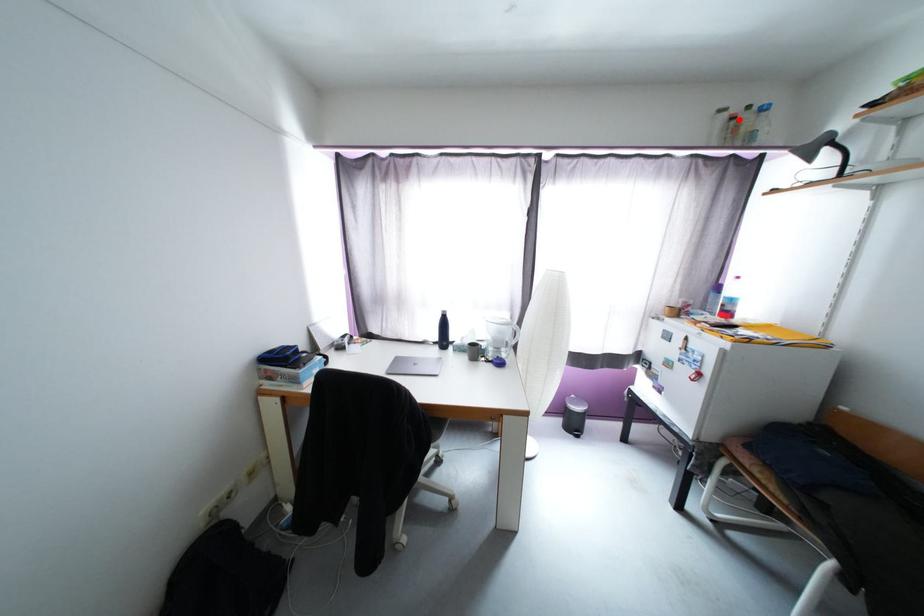
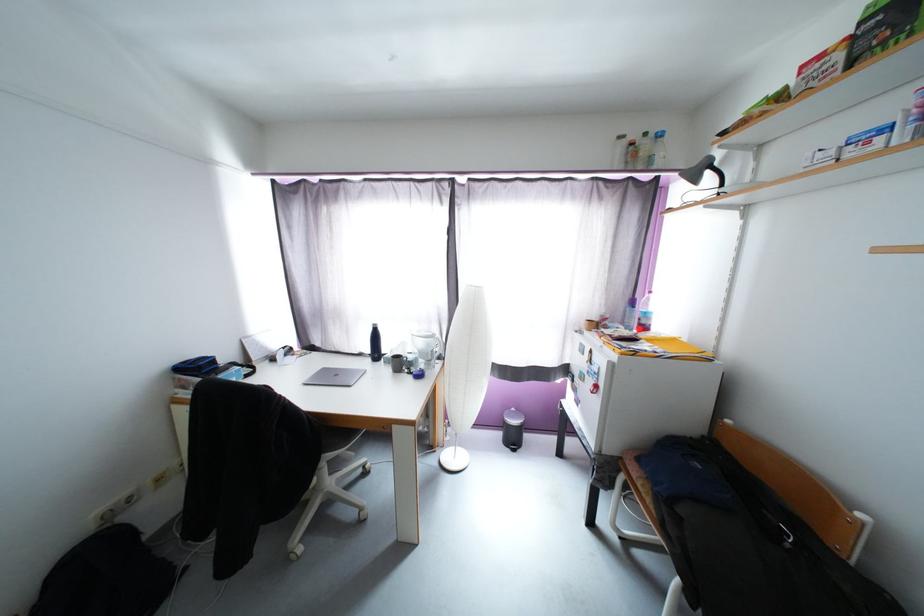
In the second image, find the point that corresponds to the highlighted location in the first image.

(638, 146)